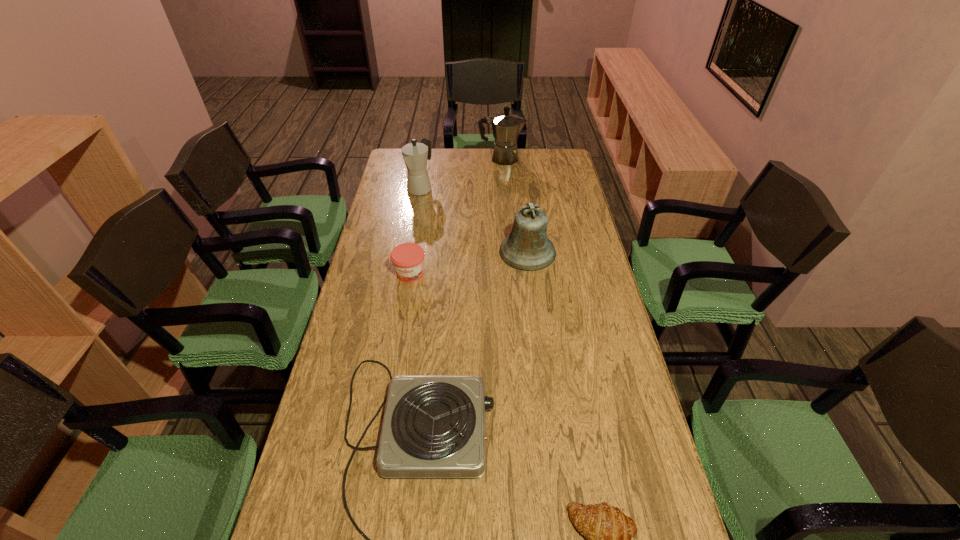
The height and width of the screenshot is (540, 960). Identify the location of the farther coffeepot. (506, 127).

Locate an element on the screen. The image size is (960, 540). the farthest object is located at coordinates (506, 127).

Locate an element on the screen. This screenshot has width=960, height=540. the second farthest object is located at coordinates (415, 155).

The height and width of the screenshot is (540, 960). I want to click on the left coffeepot, so click(x=415, y=155).

You are a GUI agent. You are given a task and a screenshot of the screen. Output one action in this format:
    pyautogui.click(x=<x>, y=<y>)
    Task: Click on the bell
    
    Given the screenshot: What is the action you would take?
    pyautogui.click(x=527, y=248)

This screenshot has width=960, height=540. Find the location of `the fourth tallest object`. the fourth tallest object is located at coordinates (408, 258).

Where is `vacant space situated on the pouring side of the farthest object`? The image size is (960, 540). vacant space situated on the pouring side of the farthest object is located at coordinates (564, 158).

The height and width of the screenshot is (540, 960). I want to click on vacant region located 0.130m on the front of the nearer coffeepot, so click(415, 217).

Find the location of a particular element. Image resolution: width=960 pixels, height=540 pixels. blank area located 0.080m on the front of the bell is located at coordinates (532, 287).

Image resolution: width=960 pixels, height=540 pixels. In order to click on vacant space situated on the front label of the jam in this screenshot , I will do `click(402, 321)`.